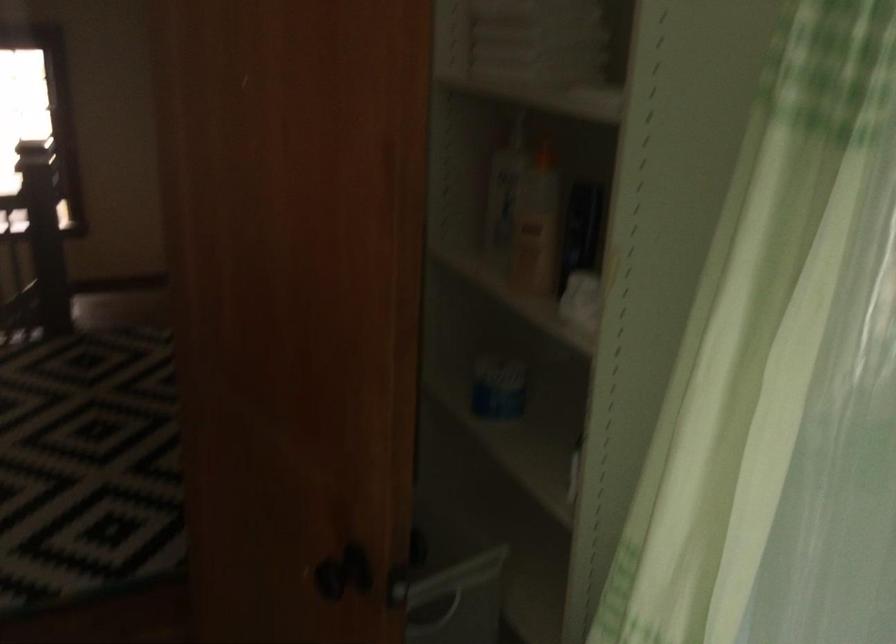
The image size is (896, 644). What do you see at coordinates (338, 576) in the screenshot?
I see `a black door knob` at bounding box center [338, 576].